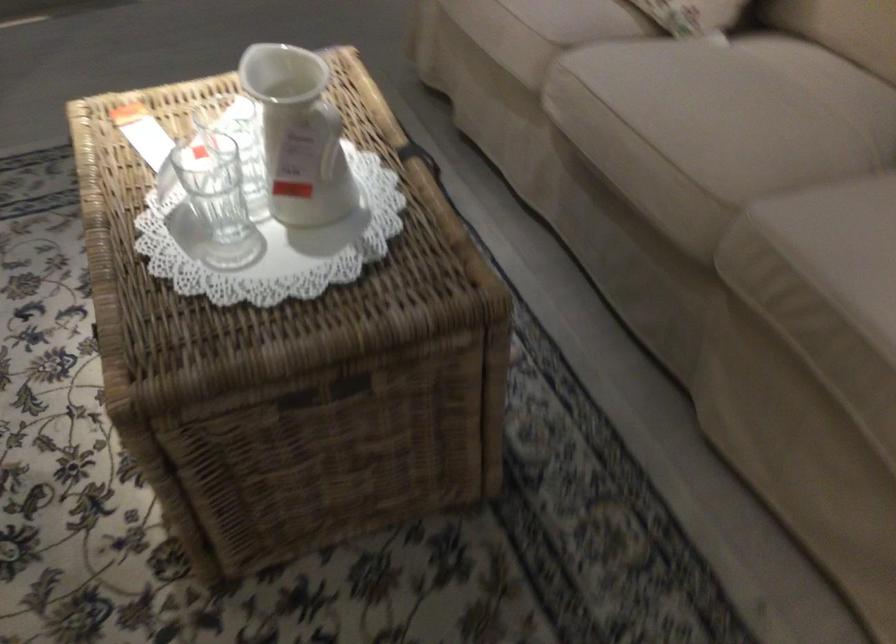
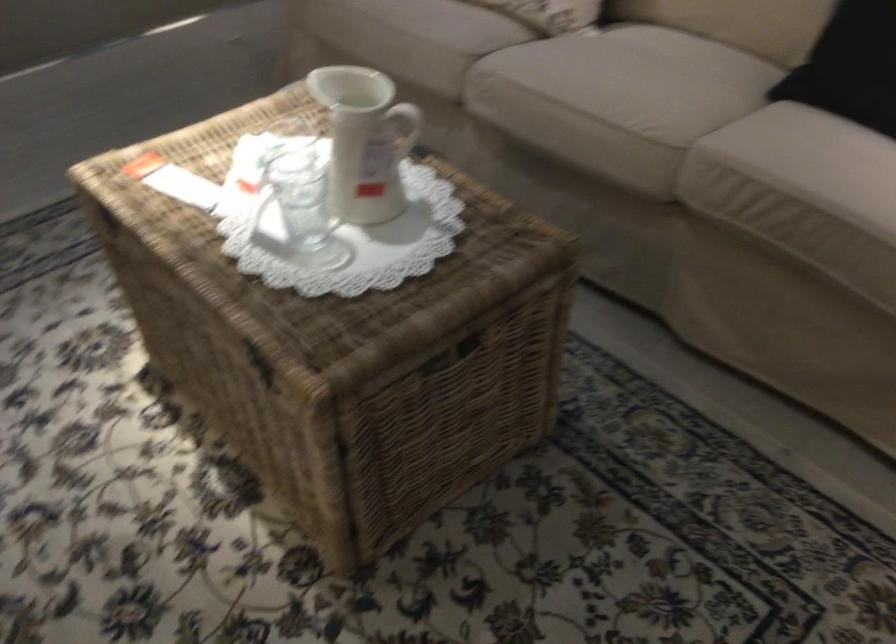
The point at [295,136] is marked in the first image. Where is the corresponding point in the second image?

(365, 140)